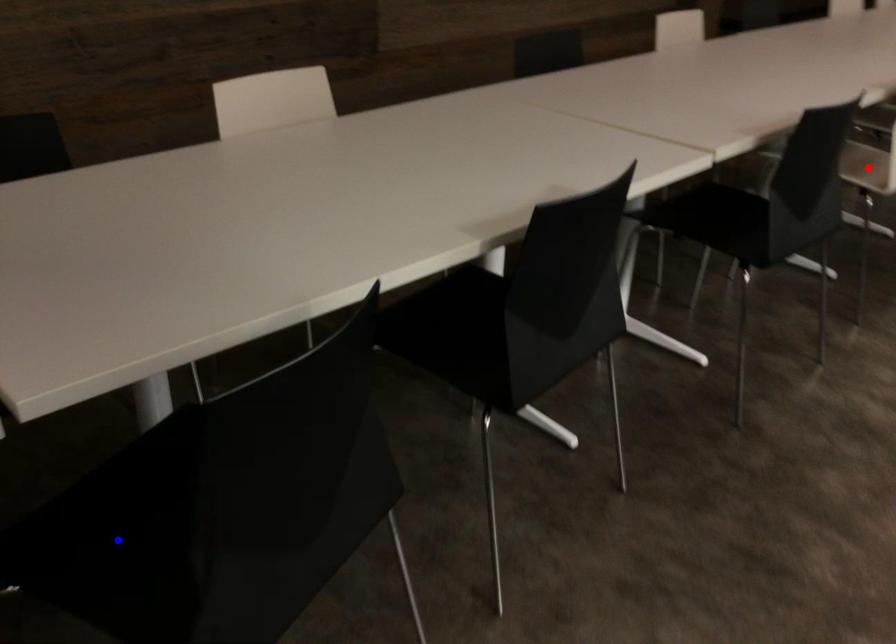
Question: Two points are marked on the image. Which point is closer to the camera?

Choices:
 (A) Blue point is closer.
 (B) Red point is closer.

Answer: (A)